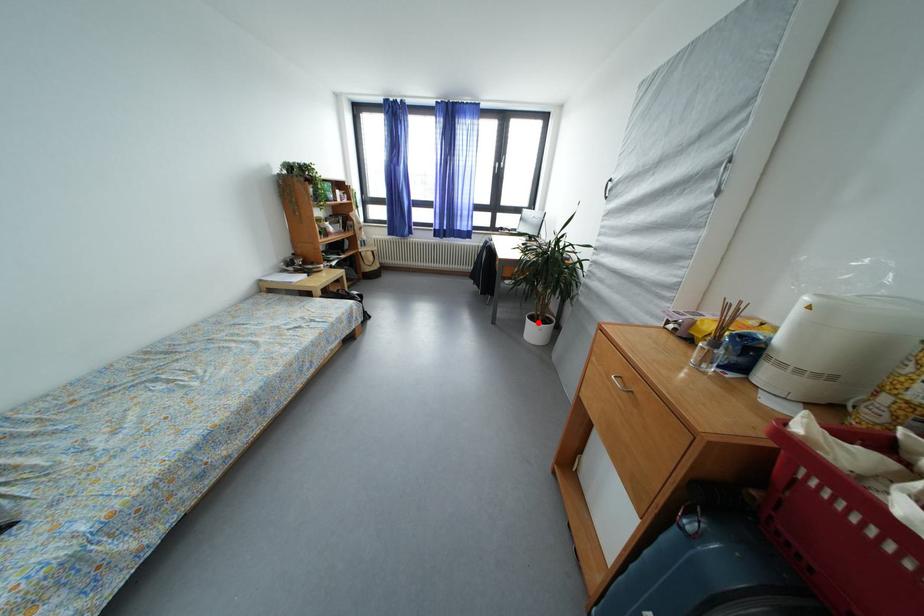
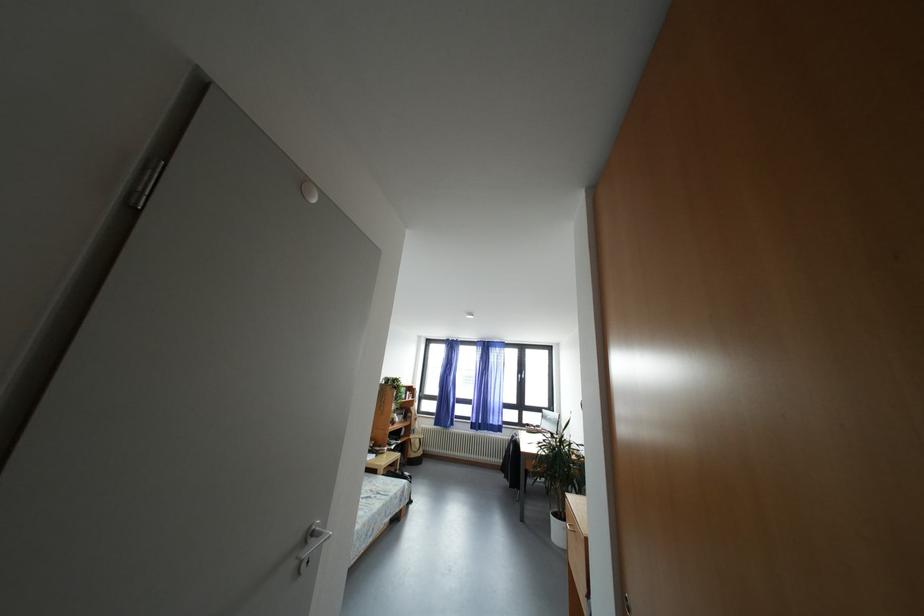
Where in the second image is the point corresponding to the highlighted location from the first image?

(562, 519)